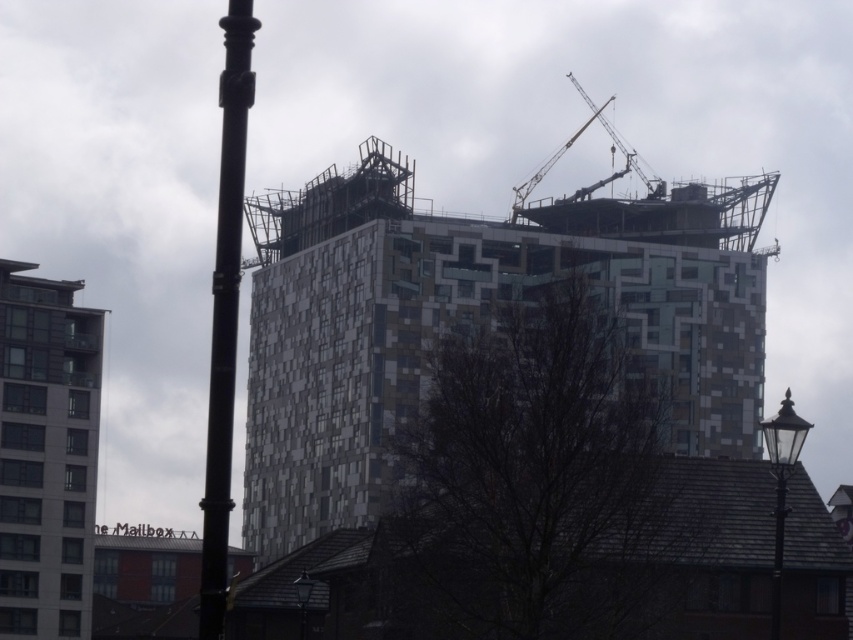
Is geometric mosaic building at center below black metal pole at left?

Incorrect, geometric mosaic building at center is not positioned below black metal pole at left.

Between geometric mosaic building at center and black metal pole at left, which one appears on the right side from the viewer's perspective?

From the viewer's perspective, geometric mosaic building at center appears more on the right side.

Where is `geometric mosaic building at center`? The width and height of the screenshot is (853, 640). geometric mosaic building at center is located at coordinates (473, 320).

Where is `geometric mosaic building at center`? Image resolution: width=853 pixels, height=640 pixels. geometric mosaic building at center is located at coordinates (473, 320).

Can you confirm if geometric mosaic building at center is positioned below metallic gray crane at upper center?

Indeed, geometric mosaic building at center is positioned under metallic gray crane at upper center.

Which is in front, point (345, 227) or point (630, 168)?

Point (345, 227)

In order to click on geometric mosaic building at center in this screenshot , I will do `click(473, 320)`.

The width and height of the screenshot is (853, 640). What do you see at coordinates (45, 454) in the screenshot?
I see `gray concrete building at lower left` at bounding box center [45, 454].

Measure the distance between point (13, 404) and camera.

Point (13, 404) and camera are 134.37 meters apart from each other.

At what (x,y) coordinates should I click in order to perform the action: click on gray concrete building at lower left. Please return your answer as a coordinate pair (x, y). Looking at the image, I should click on (45, 454).